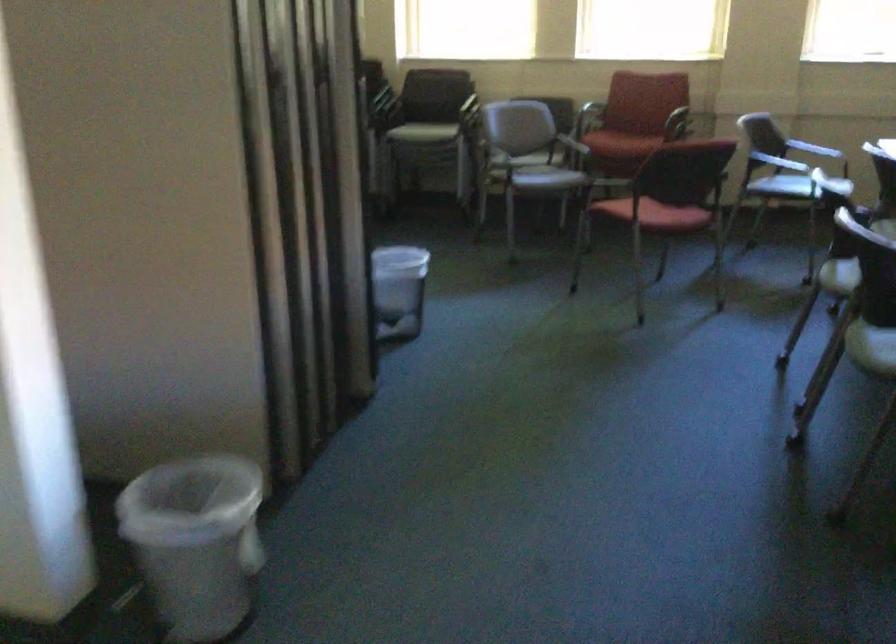
Where would you sit the red chair sitting surface? Please return your answer as a coordinate pair (x, y).

(660, 214)